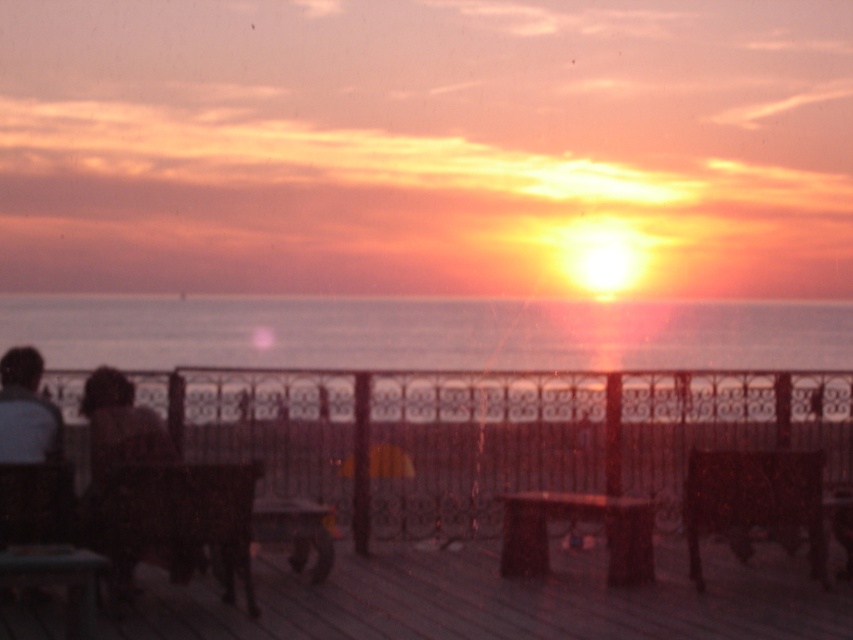
Question: Estimate the real-world distances between objects in this image. Which object is closer to the wooden deck at lower center?

Choices:
 (A) metallic ornate railing at center
 (B) wooden dock at center
 (C) dark brown hair at left

Answer: (B)

Question: Can you confirm if wooden deck at lower center is wider than dark brown hair at left?

Choices:
 (A) yes
 (B) no

Answer: (A)

Question: Observing the image, what is the correct spatial positioning of metallic ornate railing at center in reference to wooden deck at lower center?

Choices:
 (A) above
 (B) below

Answer: (A)

Question: Considering the real-world distances, which object is farthest from the wooden dock at center?

Choices:
 (A) wooden deck at lower center
 (B) metallic ornate railing at center

Answer: (B)

Question: In this image, where is smooth ocean water at center located relative to wooden deck at lower center?

Choices:
 (A) right
 (B) left

Answer: (A)

Question: Which of the following is the farthest from the observer?

Choices:
 (A) wooden dock at center
 (B) smooth ocean water at center
 (C) dark brown hair at left

Answer: (A)